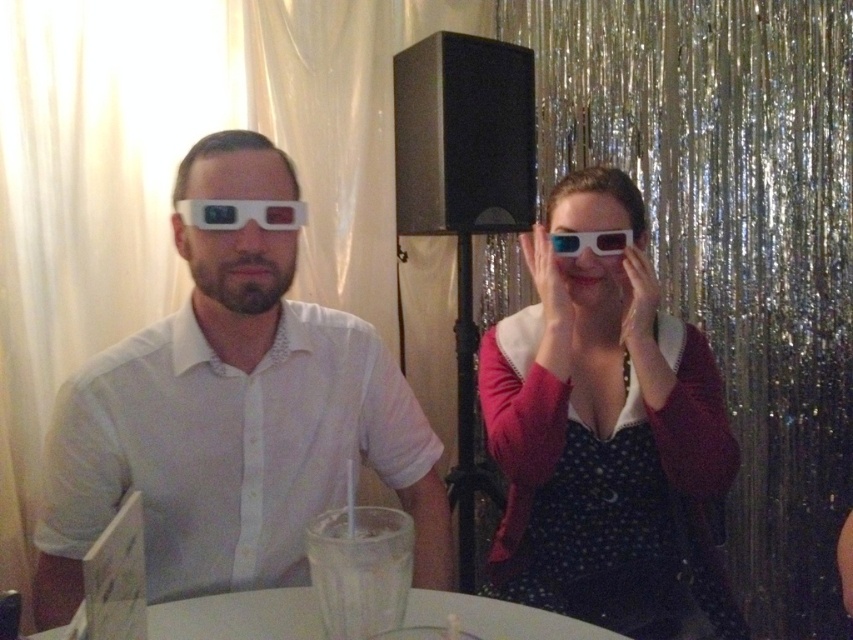
Question: Which object is closer to the camera taking this photo?

Choices:
 (A) white plastic goggles at center
 (B) white glossy table at center
 (C) white glossy 3d glasses at center

Answer: (B)

Question: Which of the following is the farthest from the observer?

Choices:
 (A) (317, 440)
 (B) (437, 620)
 (C) (672, 355)
 (D) (595, 246)

Answer: (C)

Question: Can you confirm if white glossy table at center is wider than white plastic goggles at center?

Choices:
 (A) yes
 (B) no

Answer: (A)

Question: Can you confirm if white matte 3d glasses at left is positioned to the left of white plastic goggles at center?

Choices:
 (A) no
 (B) yes

Answer: (B)

Question: Can you confirm if white glossy table at center is positioned to the left of matte plastic goggles at center?

Choices:
 (A) no
 (B) yes

Answer: (B)

Question: Which point is farther to the camera?

Choices:
 (A) (509, 632)
 (B) (566, 248)
 (C) (323, 352)
 (D) (276, 211)

Answer: (B)